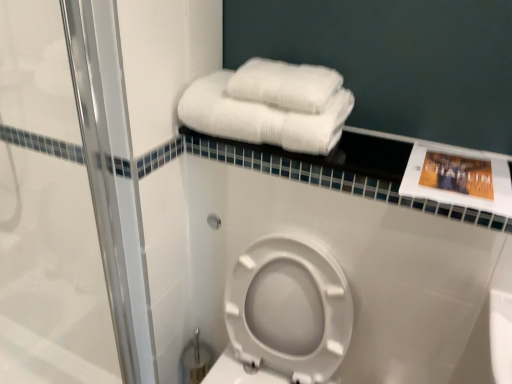
What are the coordinates of `vacant area that lies to the right of white fluffy towels at upper right, the 2th towel when ordered from top to bottom` in the screenshot? It's located at (394, 152).